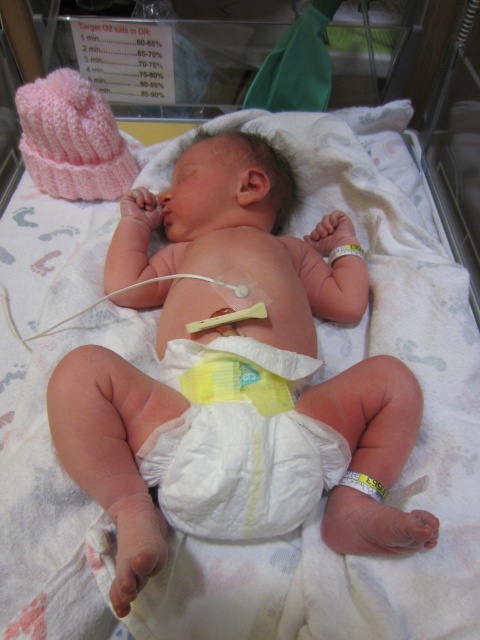
You are a nurse checking the baby in the incubator. You notice the white cloth diaper at center and the yellow rubber band at center. Which one is smaller in size?

The white cloth diaper at center has a smaller size compared to the yellow rubber band at center, so the white cloth diaper at center is smaller.

You are a nurse checking the newborn in the incubator. You need to ensure the white cloth diaper at center and the yellow rubber band at center are positioned correctly. Which object is higher up on the baby?

The white cloth diaper at center is taller than the yellow rubber band at center, so the diaper is positioned higher up on the baby.

You are a nurse checking the newborn in the incubator. You need to place a small medical sensor on the baby. The sensor must be placed above the white cloth diaper at center but below the yellow rubber band at center. Is there enough space between these two items to place the sensor?

The white cloth diaper at center is located below the yellow rubber band at center, so there is space between them. The sensor can be placed in that space above the white cloth diaper at center and below the yellow rubber band at center.